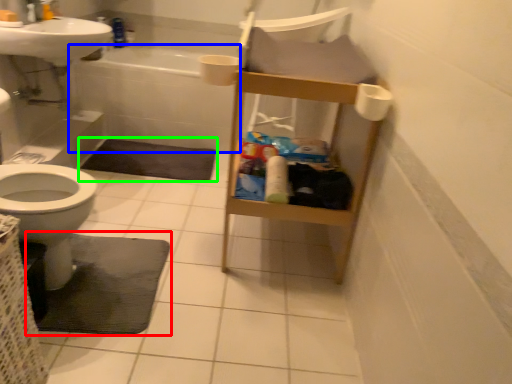
Question: Based on their relative distances, which object is farther from bath mat (highlighted by a red box)? Choose from bath (highlighted by a blue box) and bath mat (highlighted by a green box).

Choices:
 (A) bath
 (B) bath mat

Answer: (A)